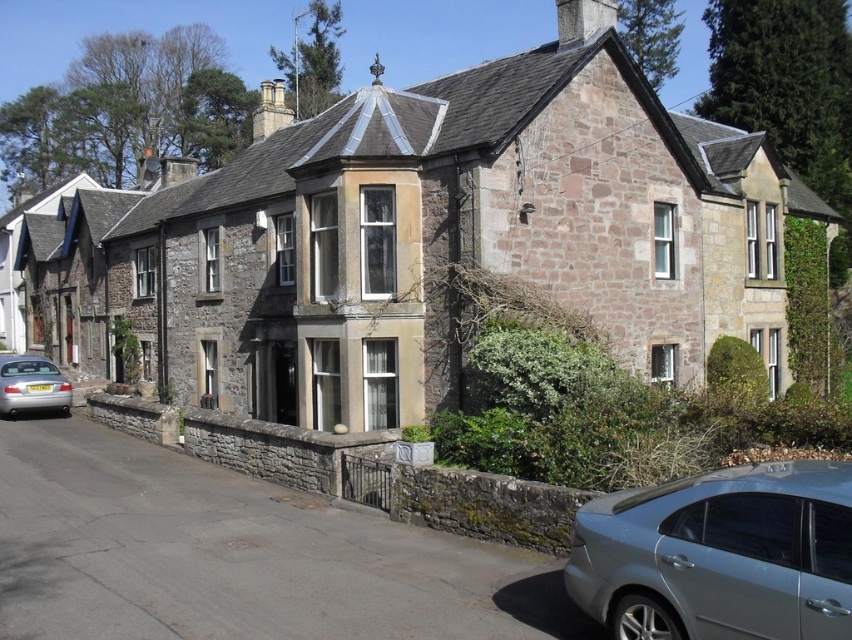
Question: Is satin silver sedan at lower right positioned in front of silver metallic car at lower left?

Choices:
 (A) yes
 (B) no

Answer: (A)

Question: Is satin silver sedan at lower right thinner than silver metallic car at lower left?

Choices:
 (A) yes
 (B) no

Answer: (A)

Question: Which of the following is the closest to the observer?

Choices:
 (A) silver metallic car at lower left
 (B) satin silver sedan at lower right

Answer: (B)

Question: Which of the following is the closest to the observer?

Choices:
 (A) silver metallic car at lower left
 (B) satin silver sedan at lower right

Answer: (B)

Question: Among these points, which one is farthest from the camera?

Choices:
 (A) (607, 556)
 (B) (33, 388)

Answer: (B)

Question: Is satin silver sedan at lower right thinner than silver metallic car at lower left?

Choices:
 (A) no
 (B) yes

Answer: (B)